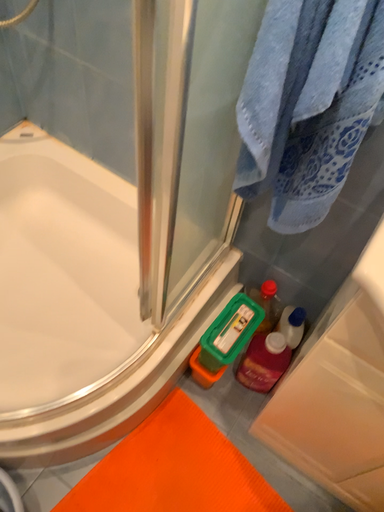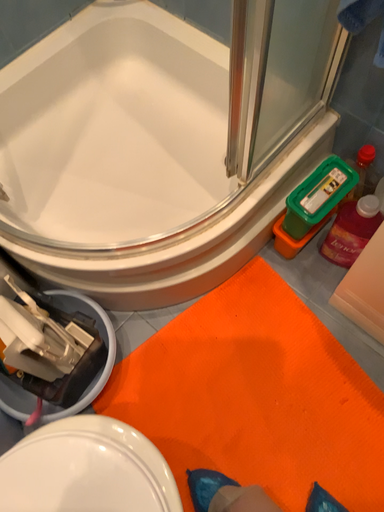
Question: How did the camera likely rotate when shooting the video?

Choices:
 (A) rotated left
 (B) rotated right

Answer: (A)